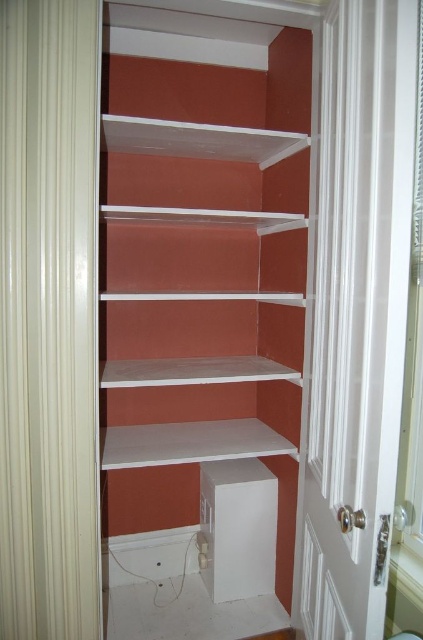
Based on the photo, you are an interior designer assessing the room layout. You notice the beige textured curtain at left and the white glossy door at center. Which object is shorter in height?

The beige textured curtain at left has a lesser height compared to the white glossy door at center, so the beige textured curtain at left is shorter in height.

You are organizing a room and need to know if there is enough space to place a large painting between the beige textured curtain at left and the white glossy door at center. Based on their sizes, can the painting fit between them?

The beige textured curtain at left occupies less space than the white glossy door at center, so the space between them may be sufficient for the painting. However, without knowing the exact dimensions of the painting, it is difficult to determine definitively.

You are standing in front of the shelving unit and want to place a small decorative item on one of the two points mentioned. Which point is closer to you, point (293, 154) or point (58, 484)?

Point (293, 154) is closer to you than point (58, 484) because it is further to the viewer according to the description.